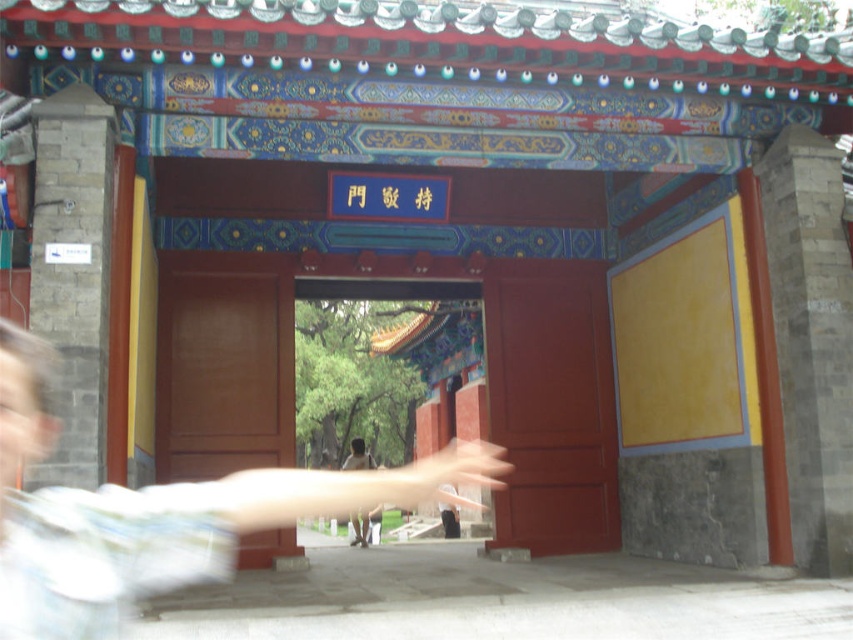
Question: Does matte wood door at left appear over light brown wooden hand at center?

Choices:
 (A) yes
 (B) no

Answer: (A)

Question: Which of the following is the closest to the observer?

Choices:
 (A) (254, 493)
 (B) (190, 298)
 (C) (506, 456)

Answer: (A)

Question: From the image, what is the correct spatial relationship of matte wood door at left in relation to light brown wooden hand at center?

Choices:
 (A) above
 (B) below

Answer: (A)

Question: Which of the following is the farthest from the observer?

Choices:
 (A) (354, 516)
 (B) (532, 541)

Answer: (A)

Question: Which is farther from the blurred motion arm at center?

Choices:
 (A) light brown wooden hand at center
 (B) matte wood door at left
 (C) matte wood door at center

Answer: (A)

Question: Does blurred motion arm at center have a lesser width compared to light brown wooden hand at center?

Choices:
 (A) no
 (B) yes

Answer: (A)